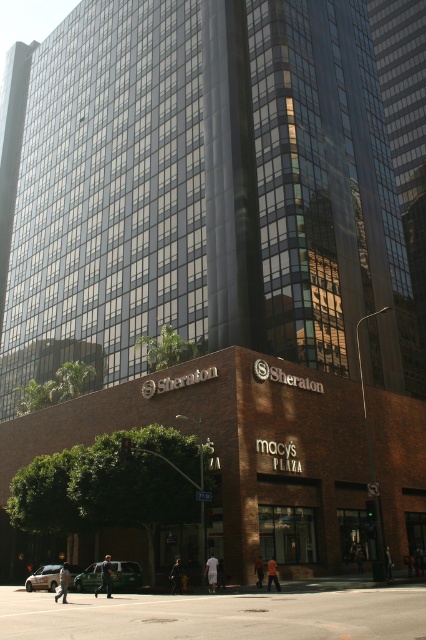
Does metallic silver car at lower left appear on the left side of silver metallic sedan at lower left?

In fact, metallic silver car at lower left is to the right of silver metallic sedan at lower left.

Does metallic silver car at lower left come behind silver metallic sedan at lower left?

No, metallic silver car at lower left is closer to the viewer.

Measure the distance between metallic silver car at lower left and camera.

metallic silver car at lower left and camera are 150.73 feet apart.

Locate an element on the screen. This screenshot has height=640, width=426. metallic silver car at lower left is located at coordinates pos(126,576).